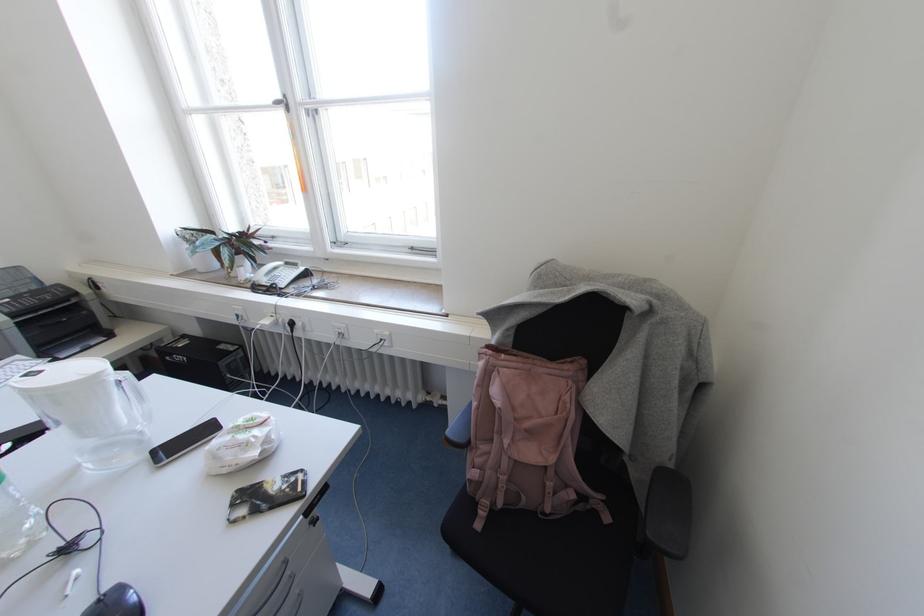
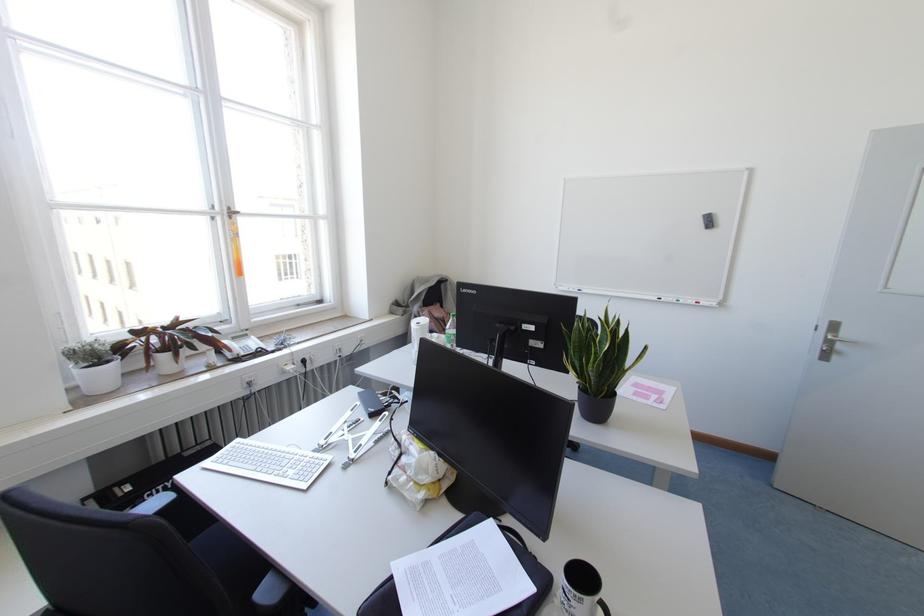
Find the pixel in the second image that matches (x=287, y=108) in the first image.

(229, 217)